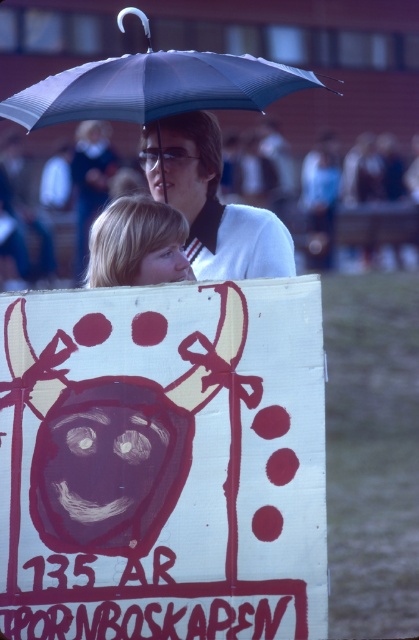
You are a photographer trying to capture a closeup of the blonde hair at lower left and the matte white shirt at upper center. Which object should you zoom in on first to ensure both are in frame?

You should zoom in on the matte white shirt at upper center first because it is smaller than the blonde hair at lower left, ensuring both fit in the frame.

Based on the photo, you are a photographer standing at the center of the scene. You want to take a photo of the white paper sign at center. Where should you point your camera to capture it in the frame?

You should point your camera towards the center of the scene at the coordinates point (163, 464) to capture the white paper sign at center in the frame.